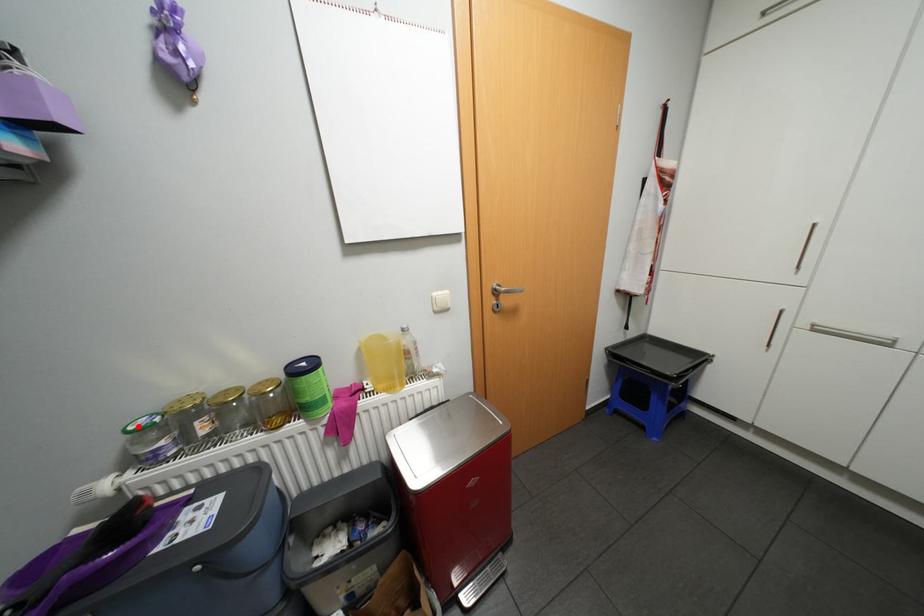
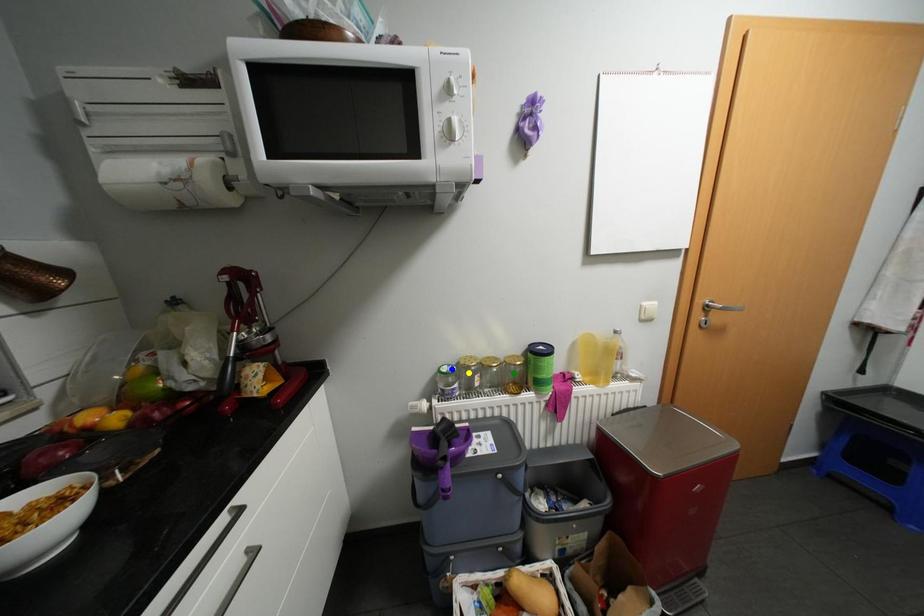
Question: I am providing you with two images of the same scene from different viewpoints. A red point is marked on the first image. You are given multiple points on the second image. Can you choose the point in image 2 that corresponds to the point in image 1?

Choices:
 (A) yellow point
 (B) blue point
 (C) green point

Answer: (B)